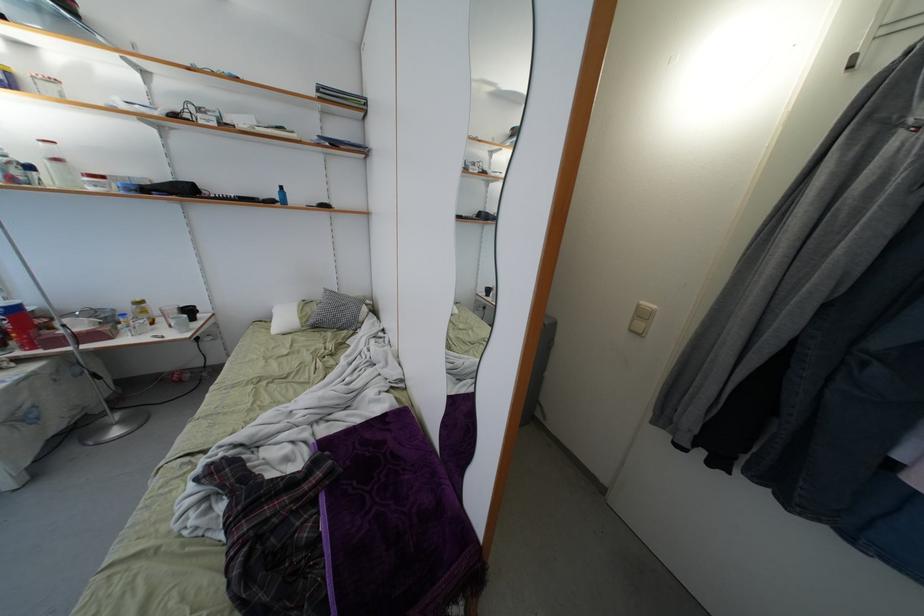
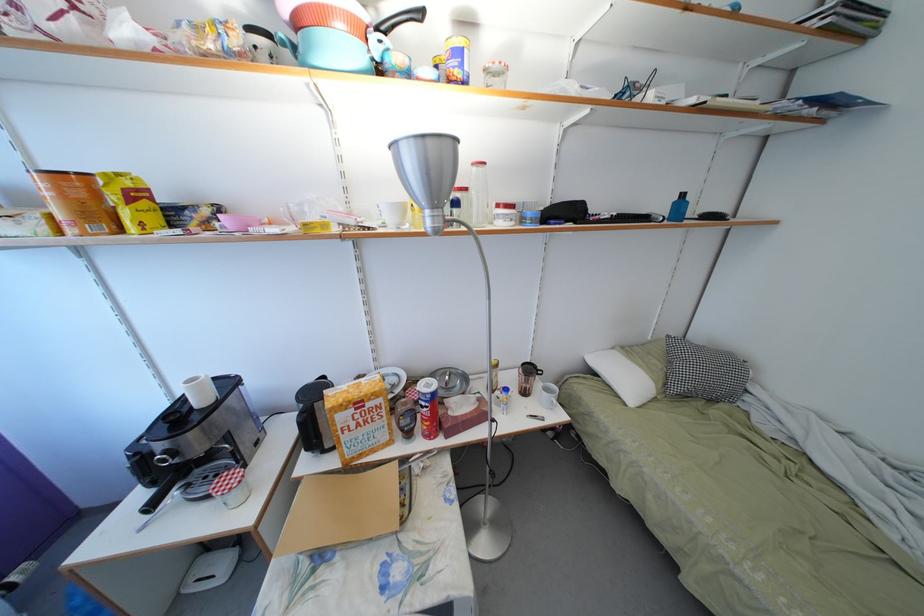
Question: Which direction would the cameraman need to move to produce the second image? Reply with the corresponding letter.

Choices:
 (A) Left
 (B) Right
 (C) Forward
 (D) Backward

Answer: (A)